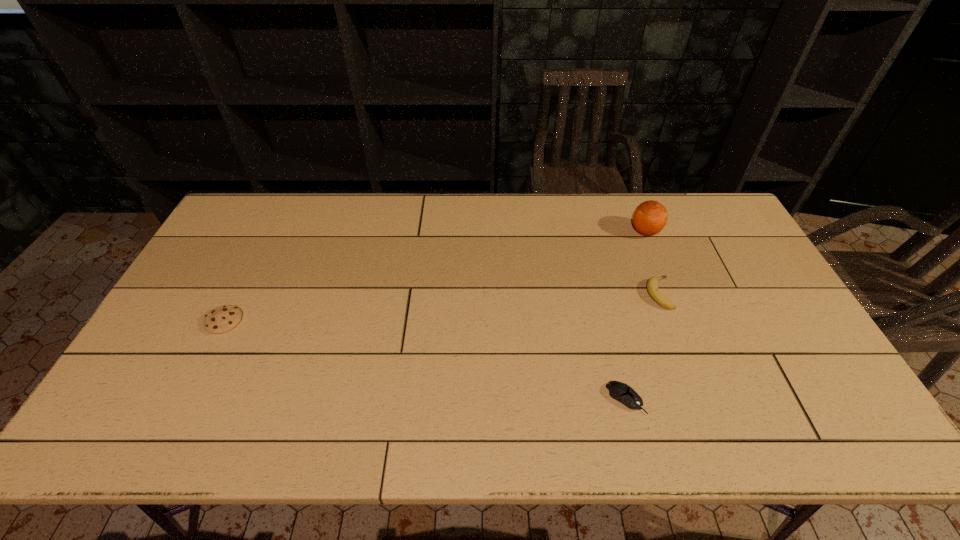
The width and height of the screenshot is (960, 540). What are the coordinates of `object situated at the far edge` in the screenshot? It's located at (650, 217).

I want to click on object that is at the near edge, so click(619, 391).

Where is `object that is at the left edge`? The width and height of the screenshot is (960, 540). object that is at the left edge is located at coordinates (224, 318).

Find the location of a particular element. vacant space at the far edge is located at coordinates (512, 222).

This screenshot has width=960, height=540. I want to click on free space at the near edge of the desktop, so click(x=237, y=438).

Identify the location of vacant region at the left edge. (190, 387).

Where is `vacant space at the right edge of the desktop`? This screenshot has height=540, width=960. vacant space at the right edge of the desktop is located at coordinates (731, 277).

Locate an element on the screen. vacant area at the far left corner of the desktop is located at coordinates tap(275, 214).

In the image, there is a desktop. In order to click on free space at the far right corner in this screenshot , I will do `click(710, 207)`.

Where is `free area in between the third object from right to left and the tallest object`? free area in between the third object from right to left and the tallest object is located at coordinates (636, 315).